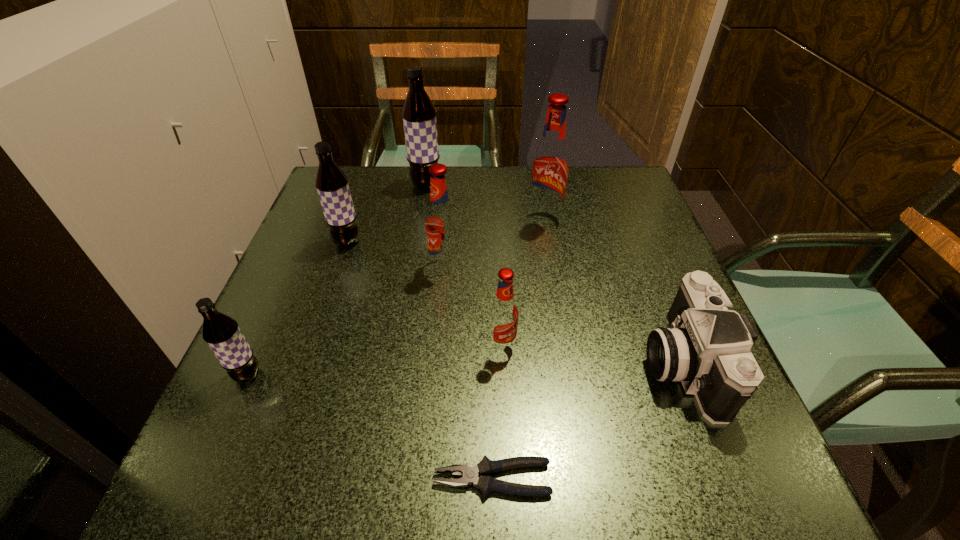
The width and height of the screenshot is (960, 540). I want to click on unoccupied area between the farthest object and the farthest red root beer, so click(485, 202).

The width and height of the screenshot is (960, 540). Identify the location of empty space between the rightmost object and the shortest object. (587, 420).

Locate which object is the fourth closest to the leftmost root beer. Please provide its 2D coordinates. Your answer should be formatted as a tuple, i.e. [(x, y)], where the tuple contains the x and y coordinates of a point satisfying the conditions above.

[(503, 314)]

What are the coordinates of `object that ranks as the sixth closest to the smallest brown root beer` in the screenshot? It's located at (550, 166).

Identify which root beer is the third nearest to the second red root beer from right to left. Please provide its 2D coordinates. Your answer should be formatted as a tuple, i.e. [(x, y)], where the tuple contains the x and y coordinates of a point satisfying the conditions above.

[(332, 186)]

Identify the location of the third closest root beer relative to the rightmost root beer. (503, 314).

Locate an element on the screen. The height and width of the screenshot is (540, 960). the closest red root beer to the rightmost object is located at coordinates (503, 314).

The height and width of the screenshot is (540, 960). I want to click on red root beer that is the closest to the shortest object, so click(x=503, y=314).

Find the location of a particular element. Image resolution: width=960 pixels, height=540 pixels. brown root beer object that ranks as the closest to the third farthest object is located at coordinates (419, 114).

What are the coordinates of `brown root beer that is the nearest to the sixth nearest object` in the screenshot? It's located at (419, 114).